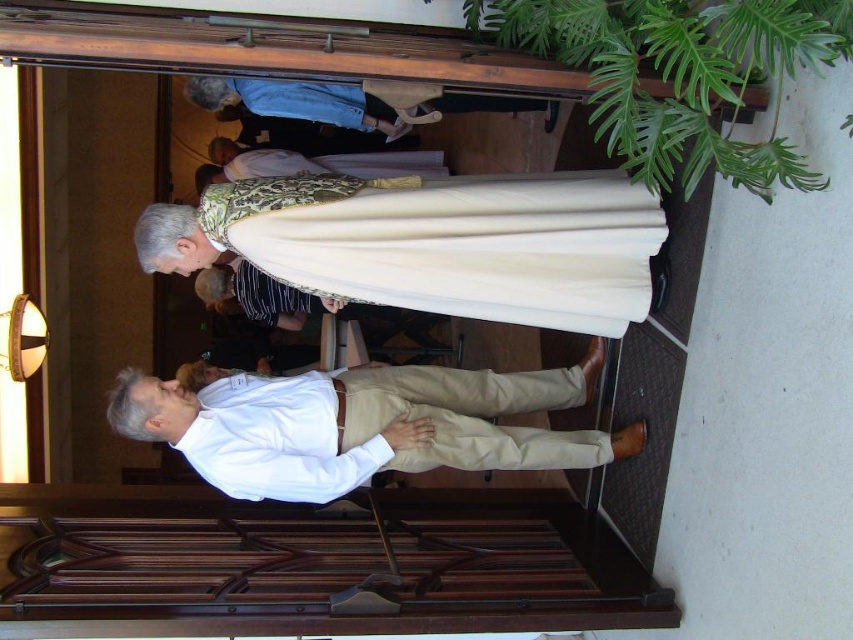
You are a photographer adjusting your camera to focus on two specific points in the scene. The first point is at coordinates point [541,429], and the second is at point [343,163]. Which point should you focus on first if you want to capture the closest object to the camera?

Point [541,429] is closer to the camera than point [343,163], so you should focus on point [541,429] first to capture the closest object.

You are a photographer at the event and need to position a spotlight on the white cotton shirt at center and the gold textured robe at center. Since the spotlight can only illuminate one object at a time, which one should you aim it at first if you want to follow the left to right order?

The gold textured robe at center is on the left side of the white cotton shirt at center, so you should aim the spotlight at the gold textured robe at center first to follow the left to right order.

In the scene shown: You are a photographer setting up for a formal event. You need to ensure that the white cotton shirt at center and the white smooth dress shirt at lower center are visible in your photo. Based on their positions, which shirt should you focus on first to ensure both are in frame?

The white cotton shirt at center is located above the white smooth dress shirt at lower center, so focusing on the white cotton shirt at center first will ensure both are in frame as the lower shirt is below it.